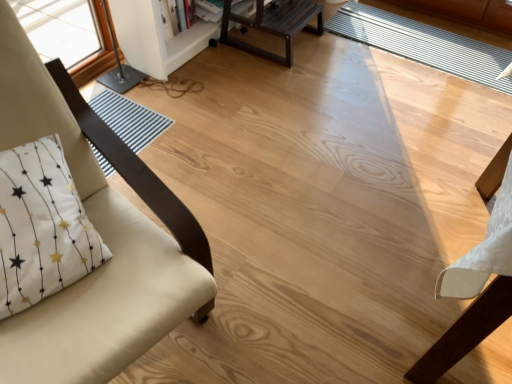
Question: Does point (483, 56) appear closer or farther from the camera than point (156, 233)?

Choices:
 (A) closer
 (B) farther

Answer: (B)

Question: Is white striped mat at center bigger or smaller than beige fabric chair at left?

Choices:
 (A) big
 (B) small

Answer: (B)

Question: Which object is the closest to the white striped mat at center?

Choices:
 (A) white painted wood bookshelf at upper center
 (B) whitetextured fabricpillow at left
 (C) dark brown wood table at upper center
 (D) beige fabric chair at left

Answer: (C)

Question: Considering the real-world distances, which object is farthest from the white striped mat at center?

Choices:
 (A) white painted wood bookshelf at upper center
 (B) beige fabric chair at left
 (C) dark brown wood table at upper center
 (D) whitetextured fabricpillow at left

Answer: (D)